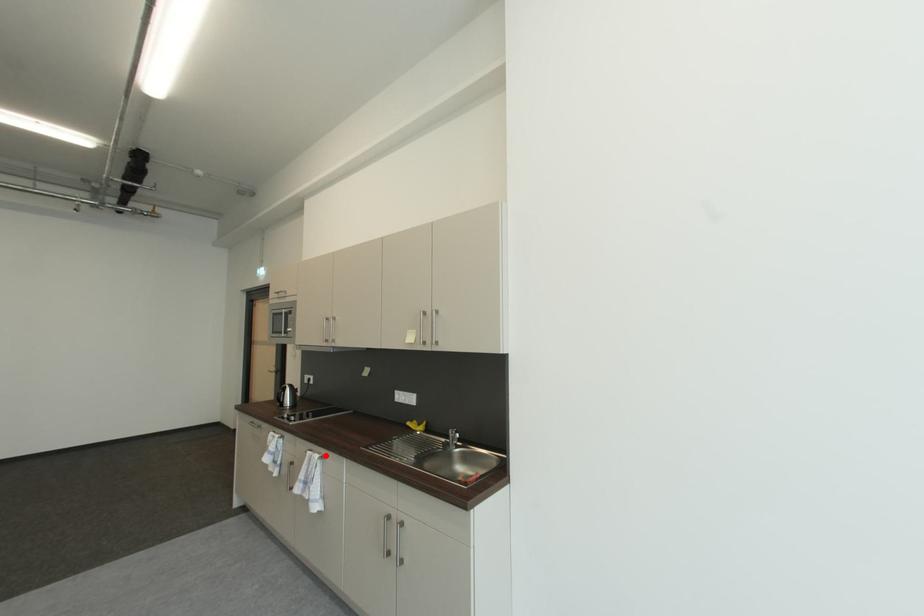
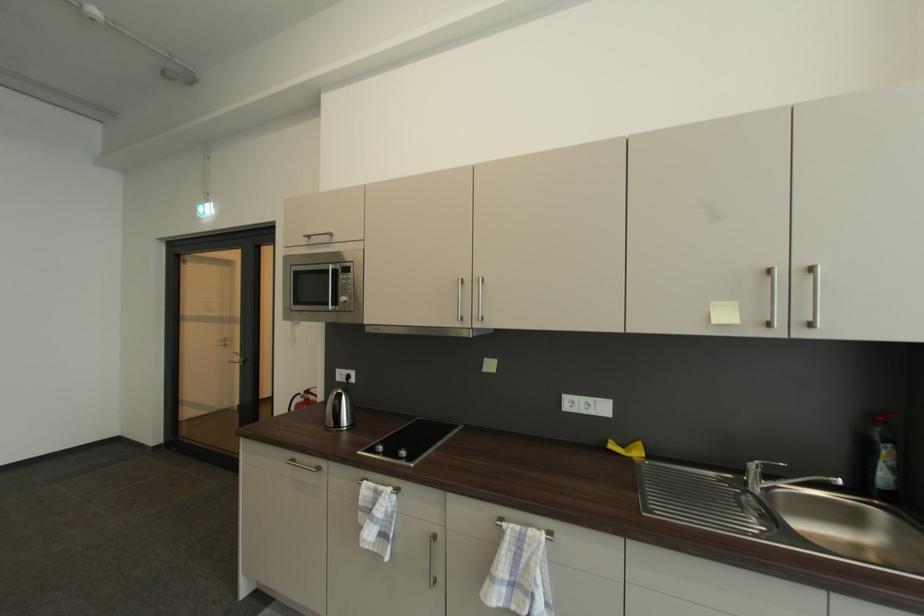
The point at the highlighted location is marked in the first image. Where is the corresponding point in the second image?

(545, 531)